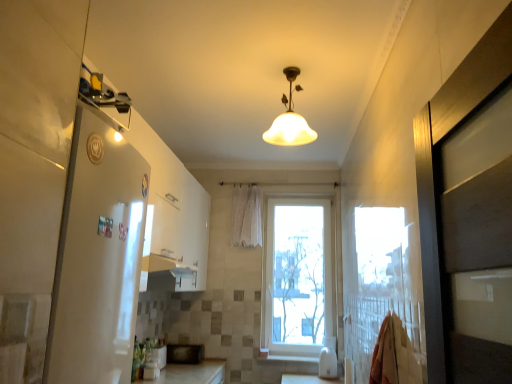
Question: From the image's perspective, is white sheer curtain at center on top of white plastic window at center?

Choices:
 (A) no
 (B) yes

Answer: (B)

Question: Does white sheer curtain at center come behind white plastic window at center?

Choices:
 (A) yes
 (B) no

Answer: (A)

Question: From a real-world perspective, is white sheer curtain at center physically above white plastic window at center?

Choices:
 (A) no
 (B) yes

Answer: (B)

Question: Is white plastic window at center a part of white sheer curtain at center?

Choices:
 (A) no
 (B) yes

Answer: (A)

Question: Considering the relative positions of white sheer curtain at center and white plastic window at center in the image provided, is white sheer curtain at center in front of white plastic window at center?

Choices:
 (A) yes
 (B) no

Answer: (B)

Question: Does white sheer curtain at center have a lesser height compared to white plastic window at center?

Choices:
 (A) no
 (B) yes

Answer: (B)

Question: Is white plastic window at center completely or partially outside of black matte microwave at center, which is the 2th appliance in front-to-back order?

Choices:
 (A) yes
 (B) no

Answer: (A)

Question: Does white plastic window at center have a lesser height compared to black matte microwave at center, which is counted as the first appliance, starting from the back?

Choices:
 (A) yes
 (B) no

Answer: (B)

Question: Does white plastic window at center have a lesser width compared to black matte microwave at center, which is the 2th appliance in front-to-back order?

Choices:
 (A) yes
 (B) no

Answer: (A)

Question: From the image's perspective, is white plastic window at center located beneath black matte microwave at center, which is counted as the first appliance, starting from the back?

Choices:
 (A) yes
 (B) no

Answer: (B)

Question: From a real-world perspective, does white plastic window at center sit lower than black matte microwave at center, which is counted as the first appliance, starting from the back?

Choices:
 (A) no
 (B) yes

Answer: (A)

Question: Could you tell me if white plastic window at center is facing black matte microwave at center, which is the 2th appliance in front-to-back order?

Choices:
 (A) yes
 (B) no

Answer: (B)

Question: Can you confirm if matte glass lampshade at center is bigger than white sheer curtain at center?

Choices:
 (A) no
 (B) yes

Answer: (B)